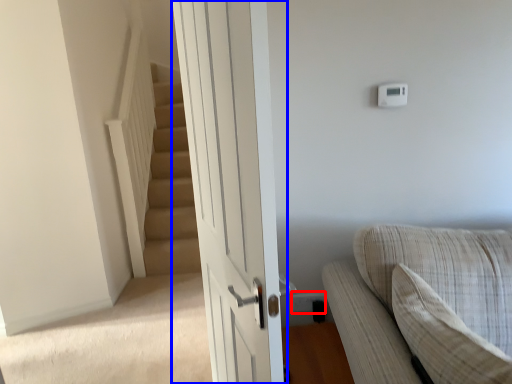
Question: Among these objects, which one is farthest to the camera, electric outlet (highlighted by a red box) or door (highlighted by a blue box)?

Choices:
 (A) electric outlet
 (B) door

Answer: (A)